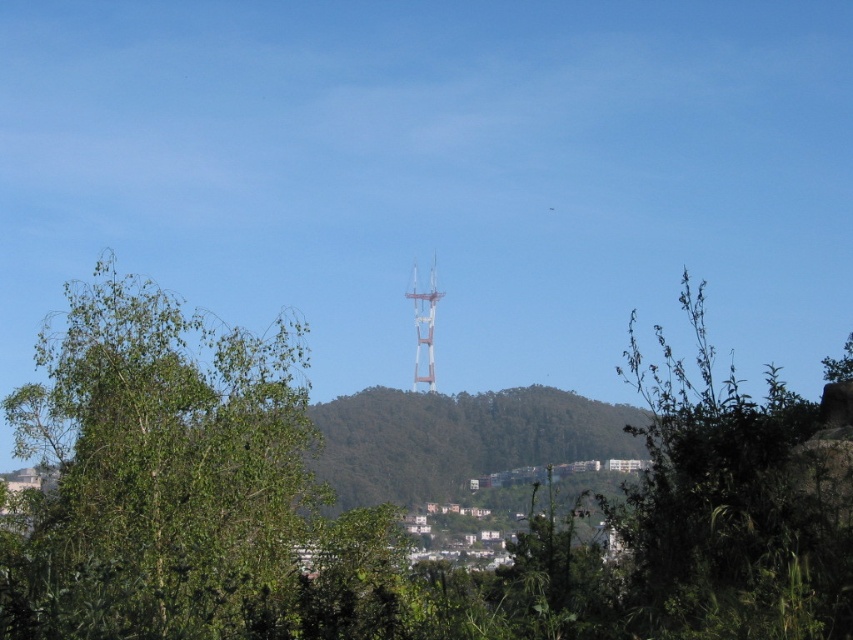
You are a landscape photographer planning to capture the metallic silver tower at center in your shot. However, there is a green leafy bush at center blocking part of the tower. Can you determine if the bush is wider than the tower?

The green leafy bush at center is wider than the metallic silver tower at center, so yes, the bush is wider than the tower.

You are standing at the base of the Sutro Tower and see the point marked at coordinates (157, 467). What object does this point indicate?

The point at coordinates (157, 467) corresponds to the green leafy tree at center.